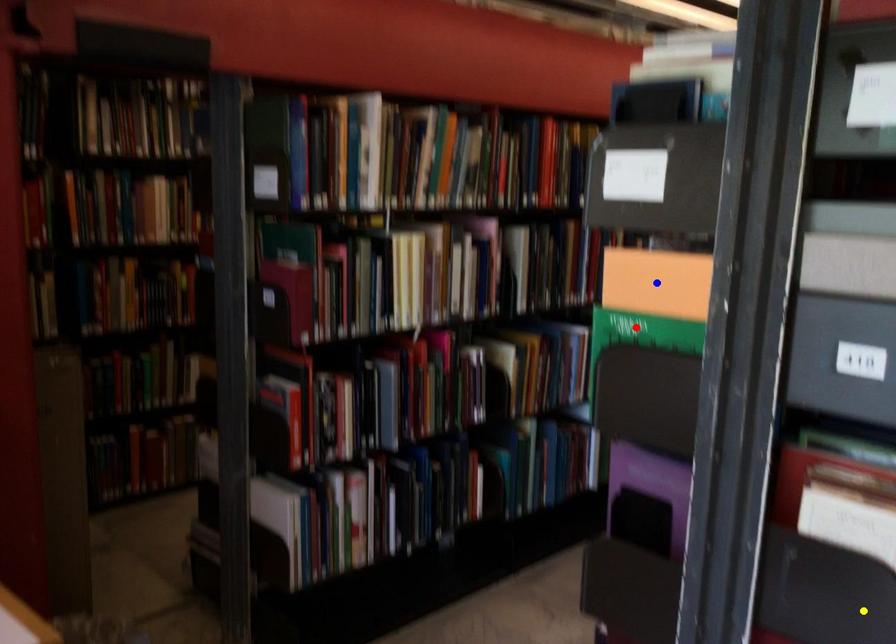
Order these from nearest to farthest:
red point | blue point | yellow point

yellow point
blue point
red point